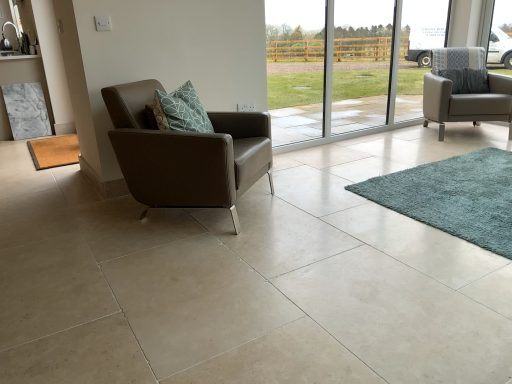
Question: Considering the positions of transparent glass door at center and brown textured mat at lower left, acting as the 2th mat starting from the right, in the image, is transparent glass door at center bigger or smaller than brown textured mat at lower left, acting as the 2th mat starting from the right,?

Choices:
 (A) small
 (B) big

Answer: (B)

Question: From a real-world perspective, is transparent glass door at center physically located above or below brown textured mat at lower left, arranged as the 1th mat when viewed from the left?

Choices:
 (A) above
 (B) below

Answer: (A)

Question: Which object is the closest to the teal shaggy rug at lower right, which appears as the 2th mat when viewed from the left?

Choices:
 (A) brown leather armchair at left, which appears as the second chair when viewed from the right
 (B) transparent glass door at center
 (C) matte gray armchair at right, the first chair positioned from the right
 (D) brown textured mat at lower left, arranged as the 1th mat when viewed from the left

Answer: (A)

Question: Which object is positioned closest to the brown textured mat at lower left, the second mat positioned from the front?

Choices:
 (A) matte gray armchair at right, the 2th chair positioned from the front
 (B) transparent glass door at center
 (C) teal shaggy rug at lower right, the 2th mat positioned from the back
 (D) brown leather armchair at left, marked as the 1th chair in a left-to-right arrangement

Answer: (D)